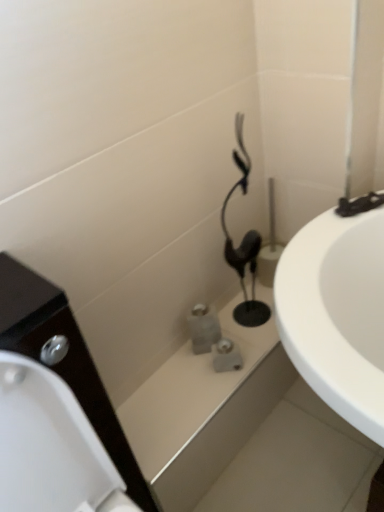
You are a GUI agent. You are given a task and a screenshot of the screen. Output one action in this format:
    pyautogui.click(x=<x>, y=<y>)
    Task: Click on the vacant space positioned to the left of black plastic hairdryer at center
    The image size is (384, 512).
    Given the screenshot: What is the action you would take?
    221,328